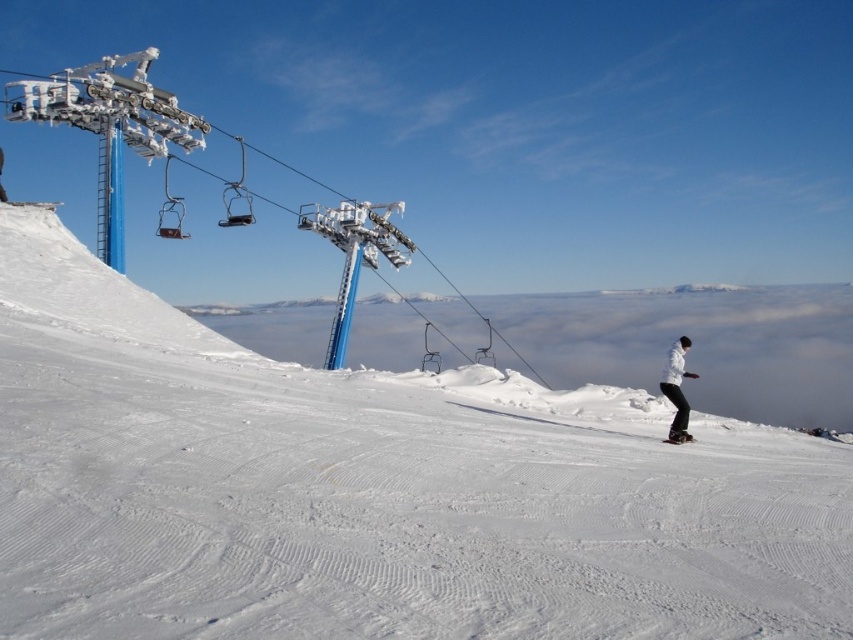
Question: Considering the relative positions of white matte snowboarder at right and white matte ski at lower right in the image provided, where is white matte snowboarder at right located with respect to white matte ski at lower right?

Choices:
 (A) right
 (B) left

Answer: (A)

Question: Where is white powdery snow at center located in relation to white matte snowboarder at right in the image?

Choices:
 (A) below
 (B) above

Answer: (B)

Question: Among these objects, which one is farthest from the camera?

Choices:
 (A) white matte snowboard at right
 (B) white matte snowboarder at right

Answer: (B)

Question: Among these objects, which one is nearest to the camera?

Choices:
 (A) white matte snowboard at right
 (B) white matte ski at lower right
 (C) white powdery snow at center
 (D) white matte snowboarder at right

Answer: (C)

Question: Based on their relative distances, which object is farther from the white matte snowboarder at right?

Choices:
 (A) white matte ski at lower right
 (B) white powdery snow at center
 (C) white matte snowboard at right

Answer: (B)

Question: Is white powdery snow at center behind white matte snowboarder at right?

Choices:
 (A) yes
 (B) no

Answer: (B)